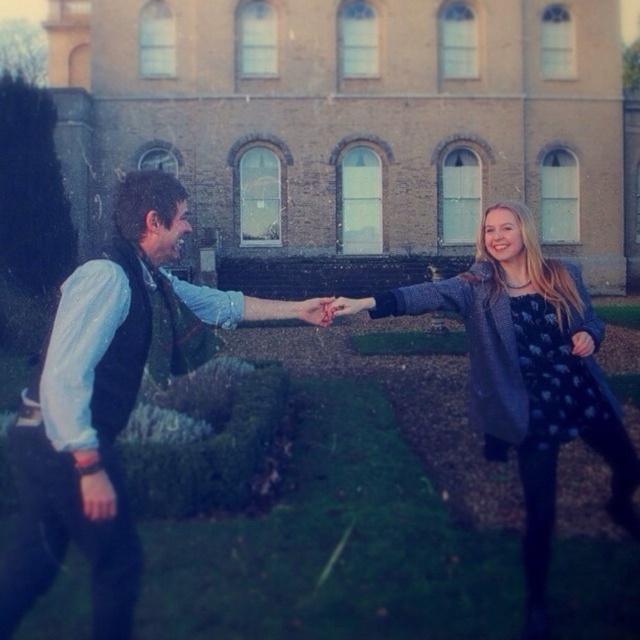
Measure the distance between matte green vest at left and camera.

They are 93.35 feet apart.

Does point (104, 481) come farther from viewer compared to point (321, 323)?

That is False.

Which is in front, point (179, 198) or point (301, 310)?

Positioned in front is point (179, 198).

Where is `matte green vest at left`? The width and height of the screenshot is (640, 640). matte green vest at left is located at coordinates (100, 404).

Does sparkly silver dress at center appear under matte pink hand at center?

No, sparkly silver dress at center is not below matte pink hand at center.

Between point (531, 467) and point (316, 304), which one is positioned behind?

The point (316, 304) is more distant.

Locate an element on the screen. sparkly silver dress at center is located at coordinates (531, 376).

Which is more to the right, matte green vest at left or sparkly silver dress at center?

sparkly silver dress at center is more to the right.

Is point (86, 522) less distant than point (484, 342)?

That is True.

Where is `matte green vest at left`? Image resolution: width=640 pixels, height=640 pixels. matte green vest at left is located at coordinates (100, 404).